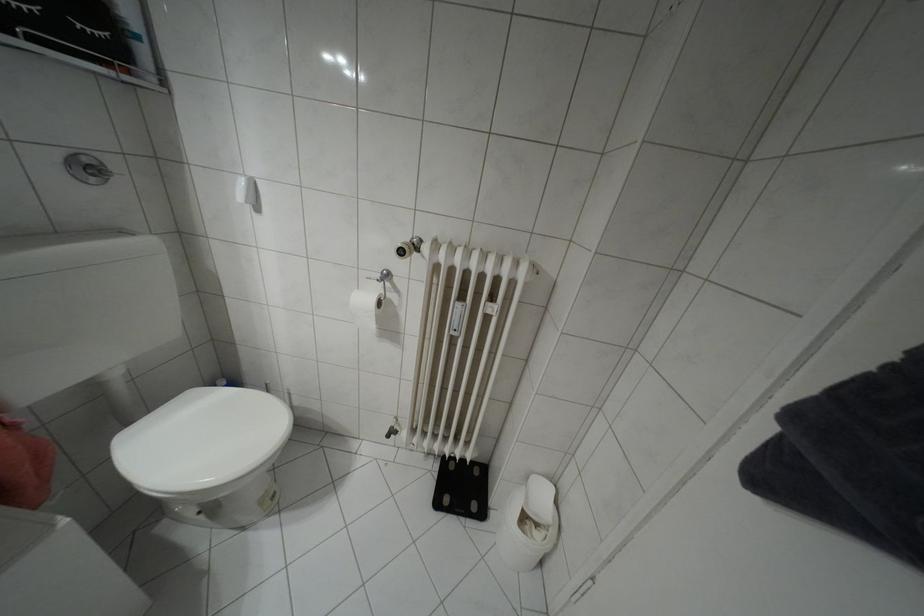
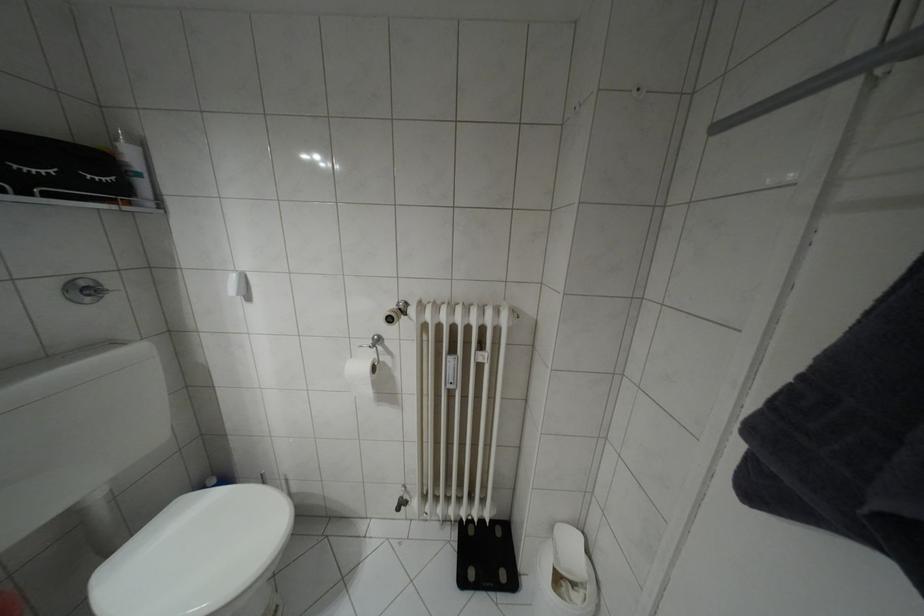
In the second image, find the point that corresponds to [86,161] in the first image.

(81, 284)